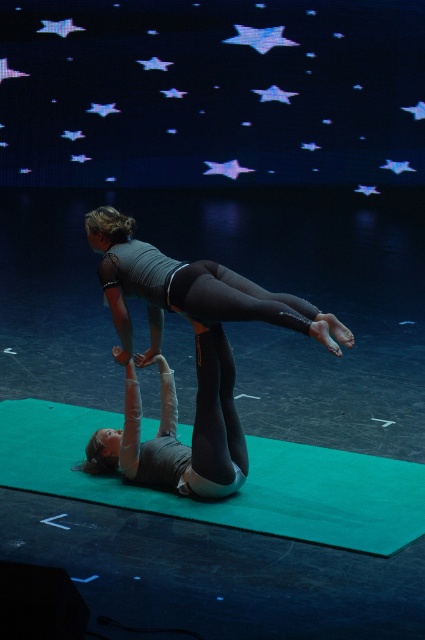
You are a stagehand setting up for an acrobatic performance. You need to ensure the green rubber yoga mat at center can fully support the matte black gymnast at upper center. Based on the scene description, will the mat be large enough?

The green rubber yoga mat at center is bigger than matte black gymnast at upper center, so yes, the mat will be large enough to fully support the gymnast.

You are a stagehand preparing for an acrobatic performance. The stage is dark with a starry night background. You need to place a green rubber yoga mat at center. Where should you place it?

You should place the green rubber yoga mat at center at point [240,490].